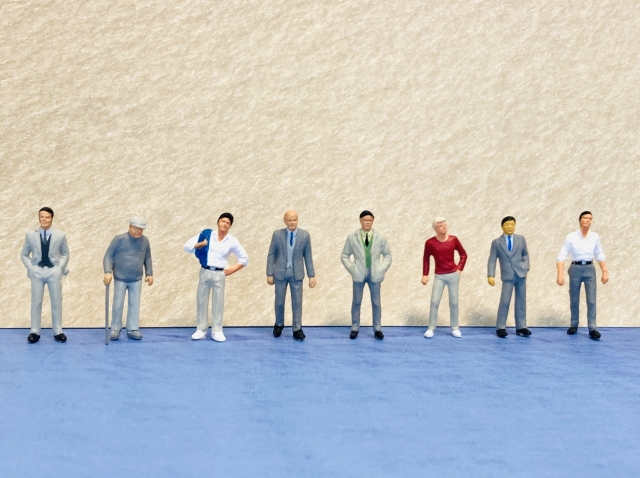
Where is `human man figurines`? Image resolution: width=640 pixels, height=478 pixels. human man figurines is located at coordinates (51, 267), (131, 266), (214, 261), (303, 257), (345, 256), (443, 256), (524, 256), (596, 263).